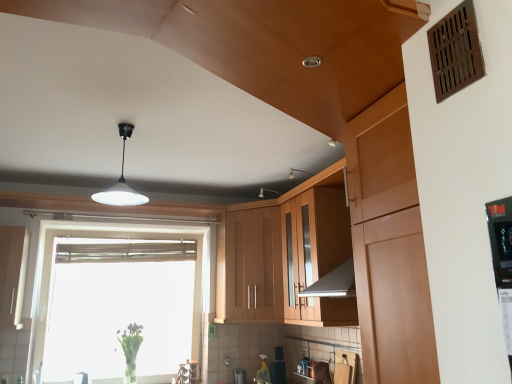
Question: In the image, is white glossy cabinet at left, which is counted as the 1th cabinetry, starting from the left, on the left side or the right side of white glossy pendant light at center?

Choices:
 (A) left
 (B) right

Answer: (A)

Question: Would you say white glossy cabinet at left, which is counted as the 1th cabinetry, starting from the left, is inside or outside white glossy pendant light at center?

Choices:
 (A) inside
 (B) outside

Answer: (B)

Question: Which of these objects is positioned closest to the transparent glass window at center?

Choices:
 (A) translucent glass vase at lower left
 (B) white glossy pendant light at center
 (C) white glossy cabinet at left, positioned as the 3th cabinetry in right-to-left order
 (D) wooden cabinet at center, the second cabinetry in the left-to-right sequence
 (E) wooden cabinet at center, the 3th cabinetry viewed from the left

Answer: (A)

Question: Considering the real-world distances, which object is farthest from the transparent glass window at center?

Choices:
 (A) translucent glass vase at lower left
 (B) wooden cabinet at center, the second cabinetry in the left-to-right sequence
 (C) white glossy cabinet at left, positioned as the 3th cabinetry in right-to-left order
 (D) wooden cabinet at center, the 3th cabinetry viewed from the left
 (E) white glossy pendant light at center

Answer: (E)